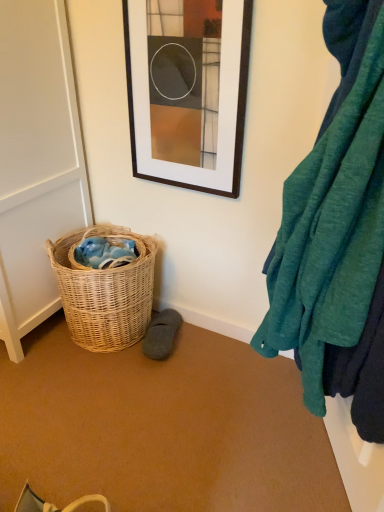
Question: Does woven natural basket at lower left lie in front of teal soft fabric at right?

Choices:
 (A) yes
 (B) no

Answer: (B)

Question: Considering the relative sizes of woven natural basket at lower left and teal soft fabric at right in the image provided, is woven natural basket at lower left thinner than teal soft fabric at right?

Choices:
 (A) no
 (B) yes

Answer: (A)

Question: Are woven natural basket at lower left and teal soft fabric at right beside each other?

Choices:
 (A) no
 (B) yes

Answer: (A)

Question: Is woven natural basket at lower left facing away from teal soft fabric at right?

Choices:
 (A) yes
 (B) no

Answer: (B)

Question: Does woven natural basket at lower left have a larger size compared to teal soft fabric at right?

Choices:
 (A) yes
 (B) no

Answer: (B)

Question: In the image, is matte black picture frame at upper center on the left side or the right side of white matte screen door at left?

Choices:
 (A) left
 (B) right

Answer: (B)

Question: Which is correct: matte black picture frame at upper center is inside white matte screen door at left, or outside of it?

Choices:
 (A) inside
 (B) outside

Answer: (B)

Question: In the image, is matte black picture frame at upper center positioned in front of or behind white matte screen door at left?

Choices:
 (A) behind
 (B) front

Answer: (A)

Question: From a real-world perspective, is matte black picture frame at upper center positioned above or below white matte screen door at left?

Choices:
 (A) above
 (B) below

Answer: (A)

Question: Does point (39, 159) appear closer or farther from the camera than point (168, 333)?

Choices:
 (A) closer
 (B) farther

Answer: (A)

Question: In terms of height, does white matte screen door at left look taller or shorter compared to gray suede slipper at lower center?

Choices:
 (A) short
 (B) tall

Answer: (B)

Question: Which is correct: white matte screen door at left is inside gray suede slipper at lower center, or outside of it?

Choices:
 (A) outside
 (B) inside

Answer: (A)

Question: Visually, is white matte screen door at left positioned to the left or to the right of gray suede slipper at lower center?

Choices:
 (A) left
 (B) right

Answer: (A)

Question: From a real-world perspective, is white matte screen door at left above or below woven natural basket at lower left?

Choices:
 (A) above
 (B) below

Answer: (A)

Question: Do you think white matte screen door at left is within woven natural basket at lower left, or outside of it?

Choices:
 (A) inside
 (B) outside

Answer: (B)